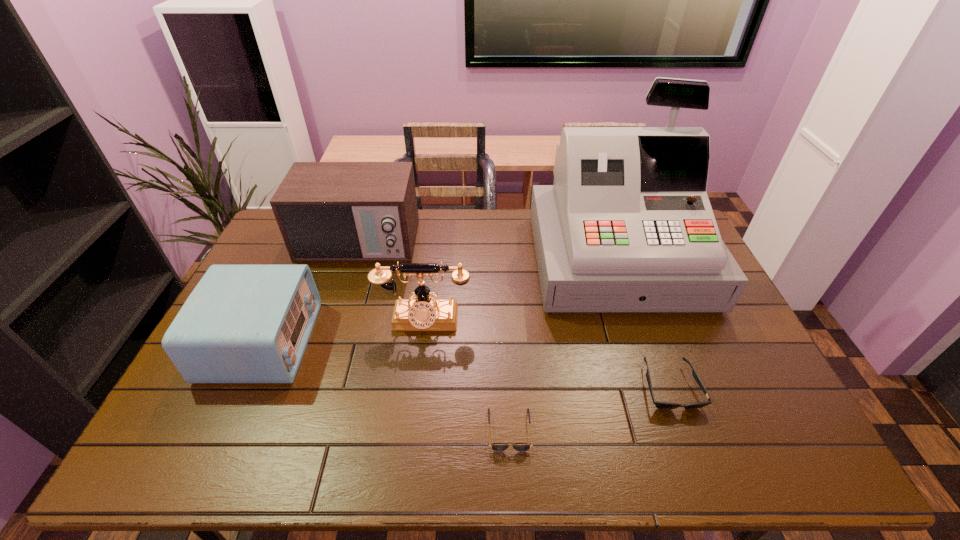
Where is `free spot between the farther radio receiver and the fourth object from left to right`? The width and height of the screenshot is (960, 540). free spot between the farther radio receiver and the fourth object from left to right is located at coordinates (434, 336).

Where is `unoccupied position between the farther radio receiver and the fourth object from left to right`? The height and width of the screenshot is (540, 960). unoccupied position between the farther radio receiver and the fourth object from left to right is located at coordinates (434, 336).

You are a GUI agent. You are given a task and a screenshot of the screen. Output one action in this format:
    pyautogui.click(x=<x>, y=<y>)
    Task: Click on the object that is the second closest to the nearer radio receiver
    The height and width of the screenshot is (540, 960).
    Given the screenshot: What is the action you would take?
    422,313

At what (x,y) coordinates should I click in order to perform the action: click on the fifth closest object to the fifth tallest object. Please return your answer as a coordinate pair (x, y). The image size is (960, 540). Looking at the image, I should click on (242, 323).

In order to click on vacant point that satisfies the following two spatial constraints: 1. on the dial of the telephone; 2. on the front panel of the fourth tallest object in this screenshot , I will do `click(420, 341)`.

I want to click on vacant area that satisfies the following two spatial constraints: 1. on the dial of the telephone; 2. on the front panel of the shorter radio receiver, so coord(420,341).

Where is `vacant area in the image that satisfies the following two spatial constraints: 1. on the keypad side of the cash register; 2. on the front panel of the shorter radio receiver`? vacant area in the image that satisfies the following two spatial constraints: 1. on the keypad side of the cash register; 2. on the front panel of the shorter radio receiver is located at coordinates click(645, 341).